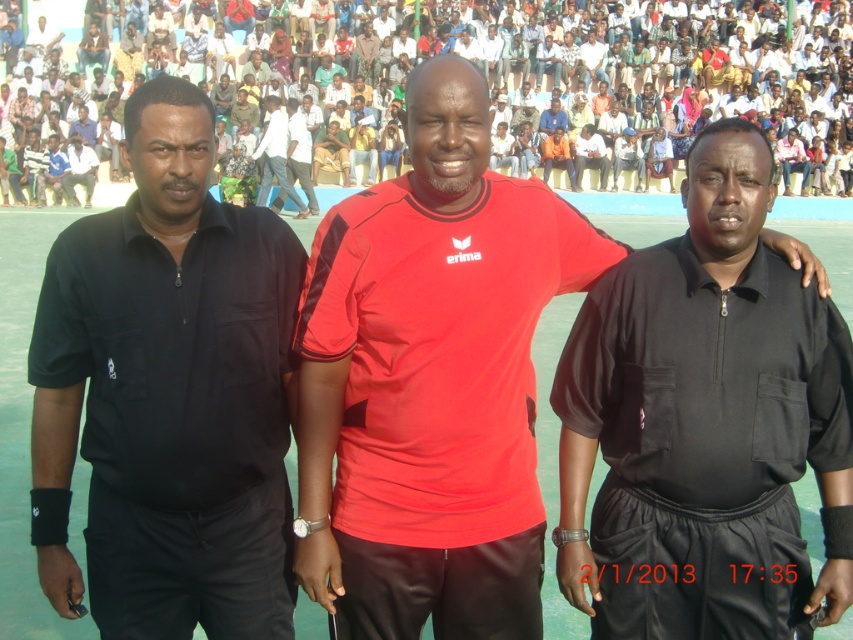
Between black matte shirt at left and light blue jeans at center, which one has more height?

light blue jeans at center

Find the location of a particular element. black matte shirt at left is located at coordinates (167, 394).

This screenshot has width=853, height=640. In order to click on black matte shirt at left in this screenshot , I will do `click(167, 394)`.

Is black matte shirt at left above red matte jersey at center?

Actually, black matte shirt at left is below red matte jersey at center.

Does point (149, 600) come behind point (422, 80)?

Yes, point (149, 600) is behind point (422, 80).

Identify the location of black matte shirt at left. Image resolution: width=853 pixels, height=640 pixels. (167, 394).

Between point (776, 426) and point (490, 236), which one is positioned in front?

Positioned in front is point (776, 426).

Which is above, black matte uniform at center or matte polyester polo shirt at center?

matte polyester polo shirt at center is higher up.

Is point (743, 486) closer to camera compared to point (374, 253)?

Yes, it is in front of point (374, 253).

You are a GUI agent. You are given a task and a screenshot of the screen. Output one action in this format:
    pyautogui.click(x=<x>, y=<y>)
    Task: Click on the black matte uniform at center
    This screenshot has height=640, width=853.
    Given the screenshot: What is the action you would take?
    pyautogui.click(x=705, y=422)